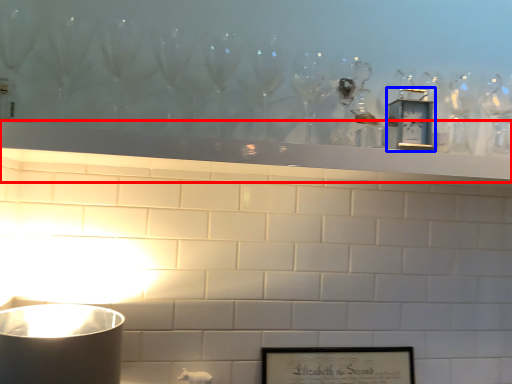
Question: Which point is further to the camera, mantle (highlighted by a red box) or clock (highlighted by a blue box)?

Choices:
 (A) mantle
 (B) clock

Answer: (B)